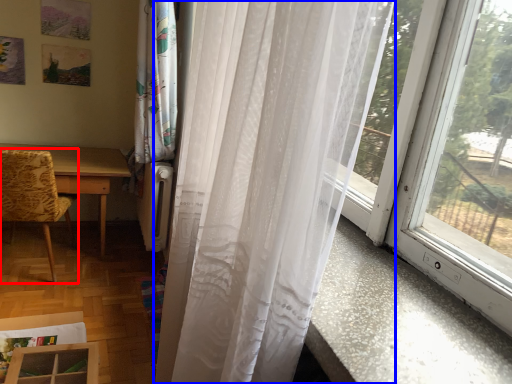
Question: Which object appears closest to the camera in this image, chair (highlighted by a red box) or curtain (highlighted by a blue box)?

Choices:
 (A) chair
 (B) curtain

Answer: (B)